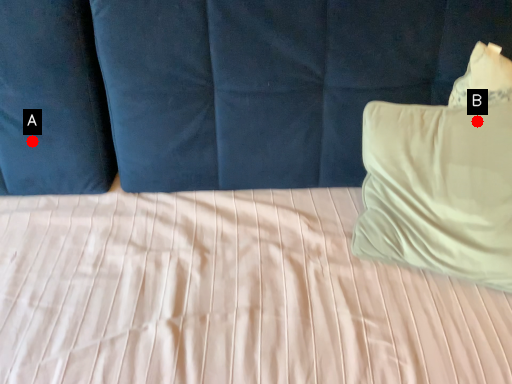
Question: Two points are circled on the image, labeled by A and B beside each circle. Which point is farther from the camera taking this photo?

Choices:
 (A) A is further
 (B) B is further

Answer: (A)